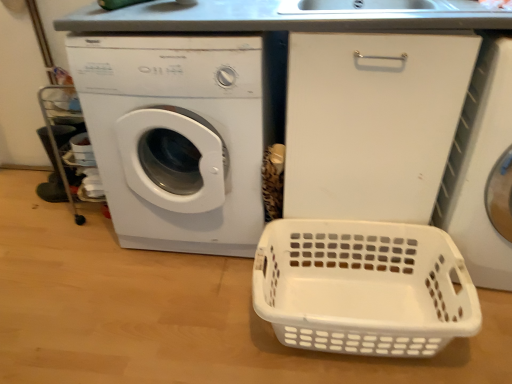
Identify the location of vacant area in front of white plastic washing machine at left, the 1th washing machine from the left. (156, 315).